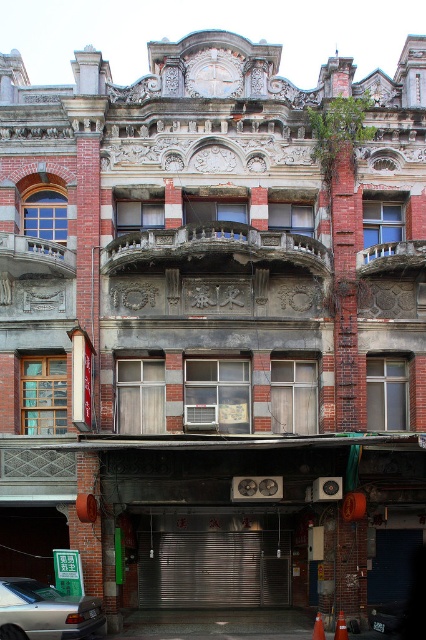
Question: Does silver metallic car at lower left appear on the left side of orange matte traffic cone at center?

Choices:
 (A) no
 (B) yes

Answer: (B)

Question: Does orange matte traffic cone at center appear over orange plastic cone at center?

Choices:
 (A) yes
 (B) no

Answer: (A)

Question: Is orange matte traffic cone at center to the left of orange plastic cone at center from the viewer's perspective?

Choices:
 (A) yes
 (B) no

Answer: (B)

Question: Which object is the farthest from the orange matte traffic cone at center?

Choices:
 (A) silver metallic car at lower left
 (B) orange plastic cone at center

Answer: (A)

Question: Which of the following is the farthest from the observer?

Choices:
 (A) (325, 637)
 (B) (40, 605)

Answer: (A)

Question: Among these points, which one is nearest to the camera?

Choices:
 (A) (94, 609)
 (B) (337, 625)
 (C) (317, 624)

Answer: (C)